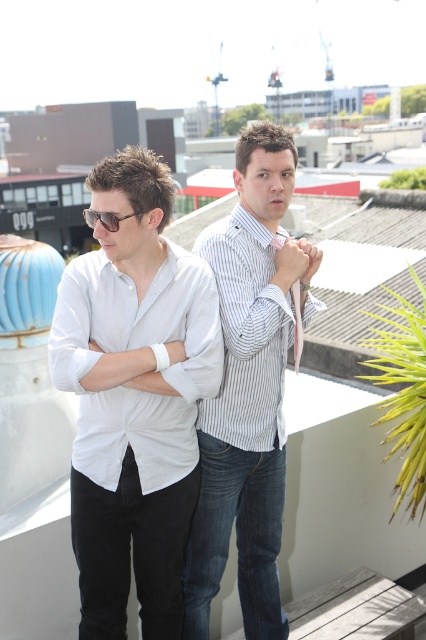
Is white cotton dress shirt at left to the left of white striped shirt at center from the viewer's perspective?

Yes, white cotton dress shirt at left is to the left of white striped shirt at center.

Is white cotton dress shirt at left further to the viewer compared to white striped shirt at center?

No, it is in front of white striped shirt at center.

Find the location of a particular element. This screenshot has width=426, height=640. white cotton dress shirt at left is located at coordinates (132, 349).

The width and height of the screenshot is (426, 640). I want to click on white cotton dress shirt at left, so click(x=132, y=349).

Can you confirm if white cotton shirt at center is smaller than matte black sunglasses at left?

Actually, white cotton shirt at center might be larger than matte black sunglasses at left.

Between white cotton shirt at center and matte black sunglasses at left, which one appears on the right side from the viewer's perspective?

white cotton shirt at center

Measure the distance between white cotton shirt at center and camera.

white cotton shirt at center is 2.56 meters from camera.

The image size is (426, 640). Find the location of `white cotton shirt at center`. white cotton shirt at center is located at coordinates pyautogui.click(x=239, y=490).

Is point (235, 289) farther from camera compared to point (112, 227)?

Yes, point (235, 289) is farther from viewer.

Between striped fabric shirt at center and matte black sunglasses at left, which one appears on the left side from the viewer's perspective?

From the viewer's perspective, matte black sunglasses at left appears more on the left side.

Is point (273, 339) positioned after point (112, 220)?

Yes.

Locate an element on the screen. striped fabric shirt at center is located at coordinates (255, 292).